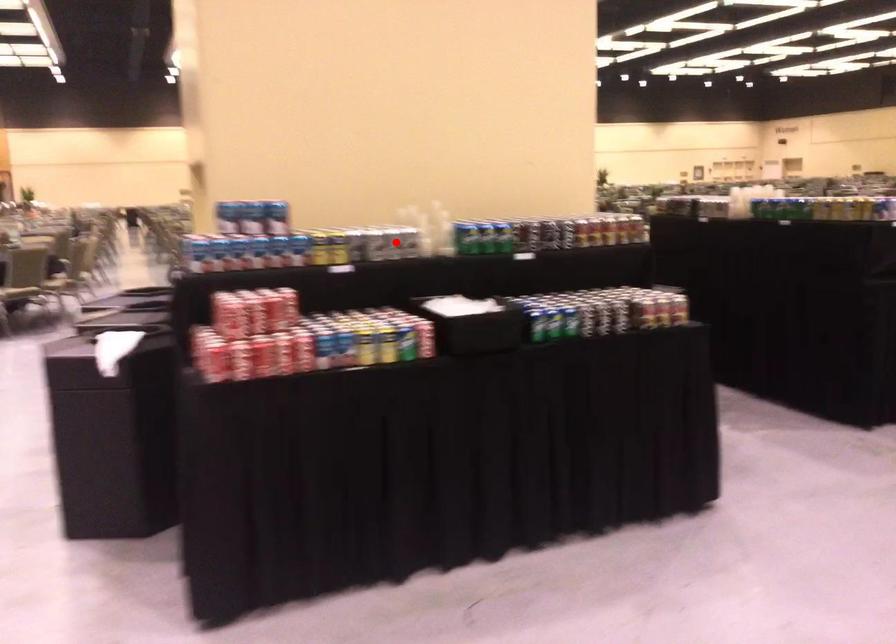
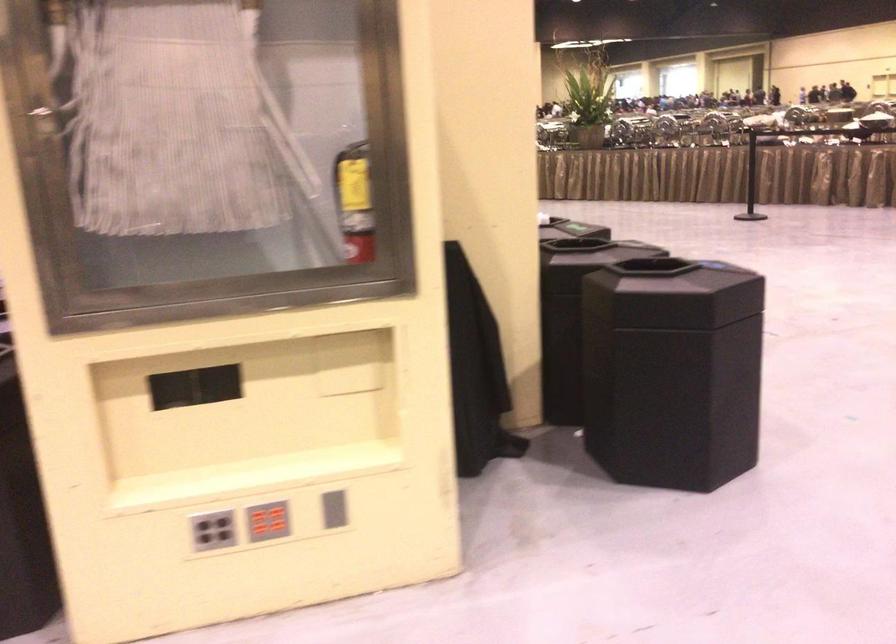
Question: I am providing you with two images of the same scene from different viewpoints. A red point is marked on the first image. Is the red point's position out of view in image 2?

Choices:
 (A) Yes
 (B) No

Answer: (A)